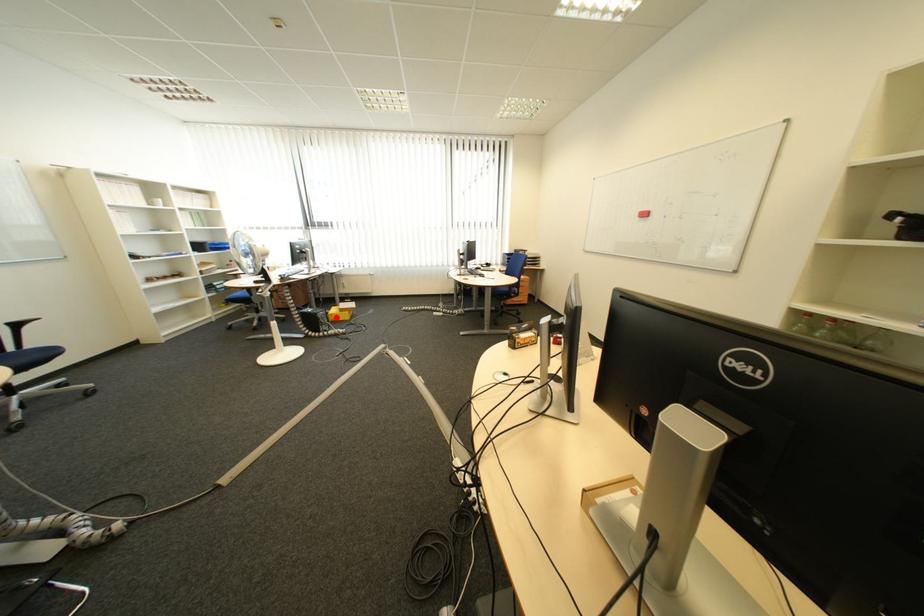
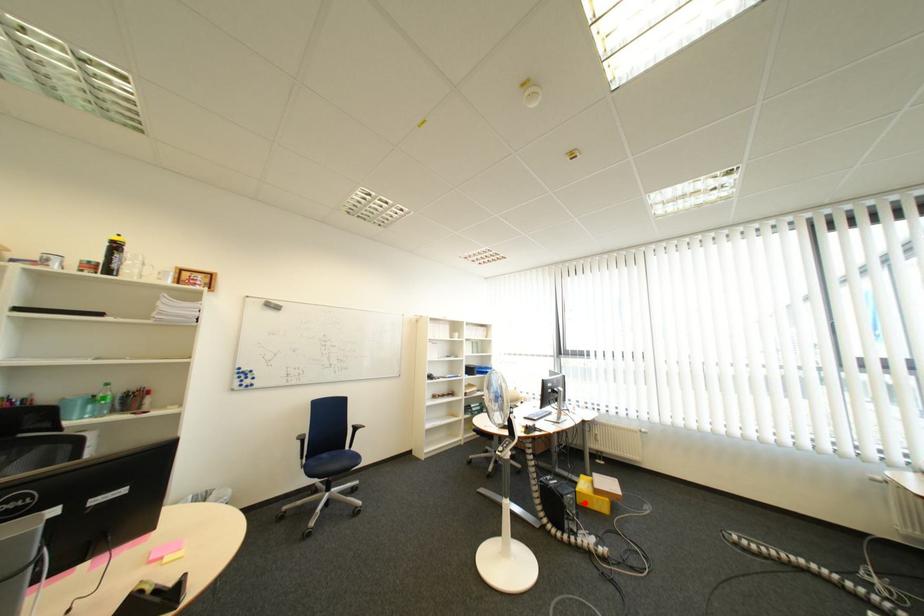
I am providing you with two images of the same scene from different viewpoints. A red point is marked on the first image and another point is marked on the second image. Is the marked point in image1 the same physical position as the marked point in image2?

Yes